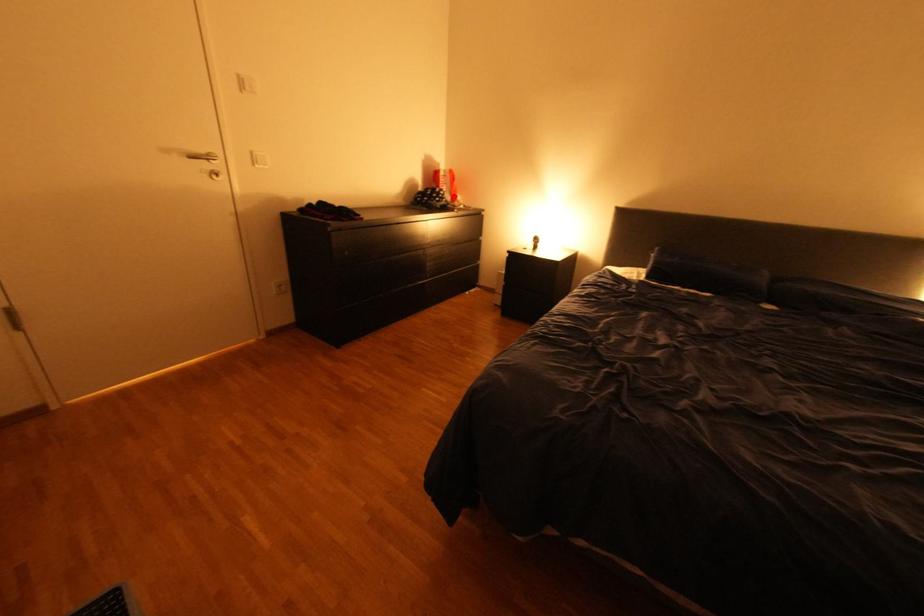
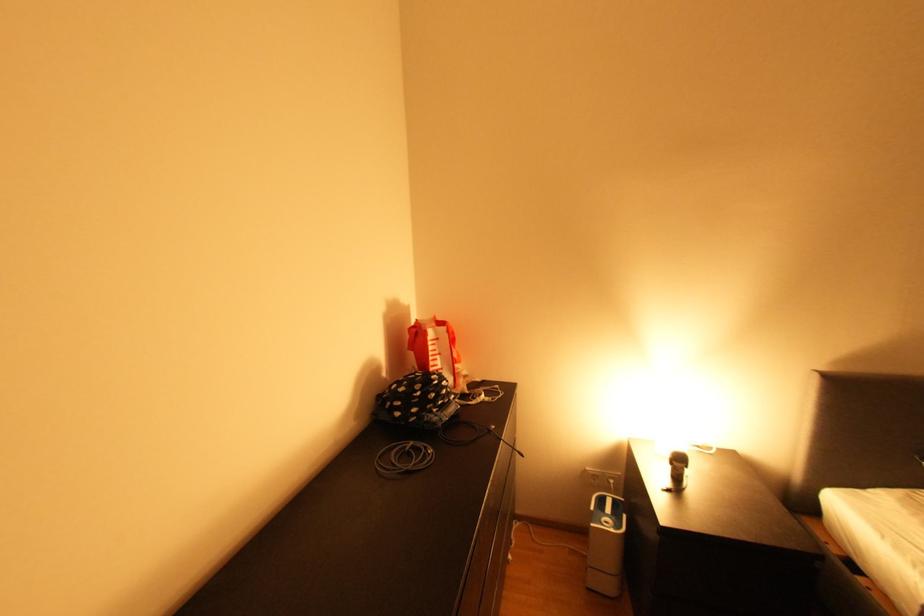
The point at the highlighted location is marked in the first image. Where is the corresponding point in the second image?

(457, 389)